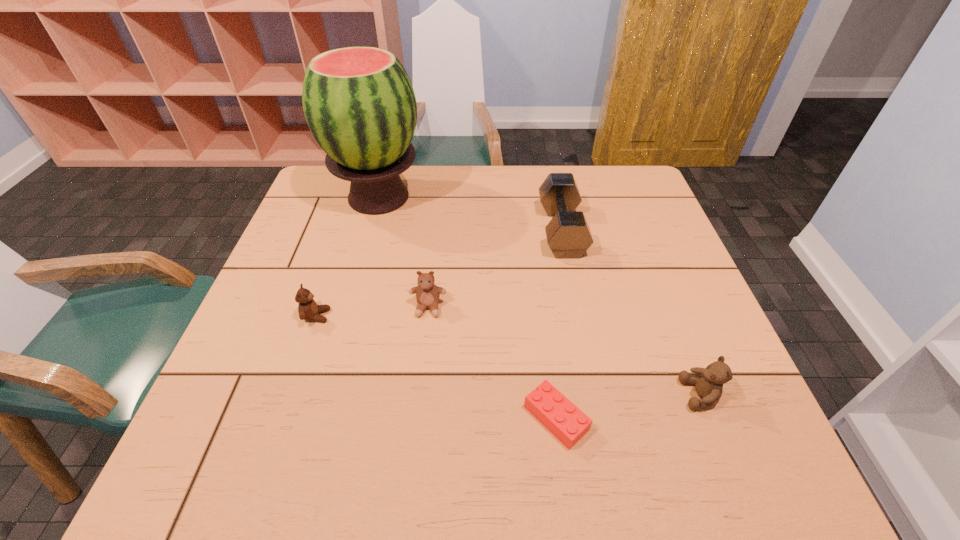
The height and width of the screenshot is (540, 960). I want to click on object that is positioned at the right edge, so click(709, 385).

Where is `object situated at the far left corner`? The image size is (960, 540). object situated at the far left corner is located at coordinates (359, 103).

Identify the location of blank space at the far edge. (499, 194).

Where is `vacant space at the near edge of the desktop`? The width and height of the screenshot is (960, 540). vacant space at the near edge of the desktop is located at coordinates (533, 476).

The width and height of the screenshot is (960, 540). In the image, there is a desktop. Find the location of `free space at the left edge`. free space at the left edge is located at coordinates (331, 211).

Locate an element on the screen. This screenshot has width=960, height=540. free space at the right edge of the desktop is located at coordinates (673, 288).

You are a GUI agent. You are given a task and a screenshot of the screen. Output one action in this format:
    pyautogui.click(x=<x>, y=<y>)
    Task: Click on the blank space at the far left corner of the desktop
    
    Given the screenshot: What is the action you would take?
    pyautogui.click(x=324, y=193)

Locate an element on the screen. The height and width of the screenshot is (540, 960). free space at the far right corner of the desktop is located at coordinates (617, 166).

Locate an element on the screen. The image size is (960, 540). free space between the dumbbell and the Lego is located at coordinates (559, 324).

This screenshot has height=540, width=960. I want to click on vacant area that lies between the watermelon and the leftmost teddy bear, so click(348, 256).